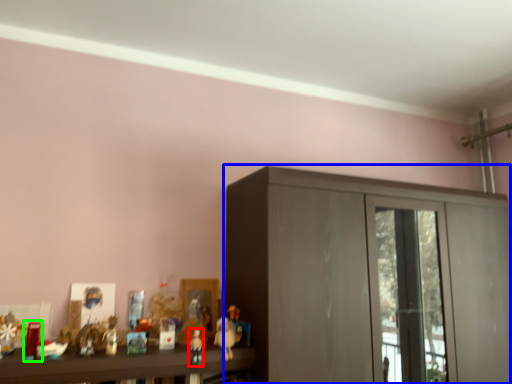
Question: Considering the real-world distances, which object is closest to toy (highlighted by a red box)? cupboard (highlighted by a blue box) or toy (highlighted by a green box).

Choices:
 (A) cupboard
 (B) toy

Answer: (B)